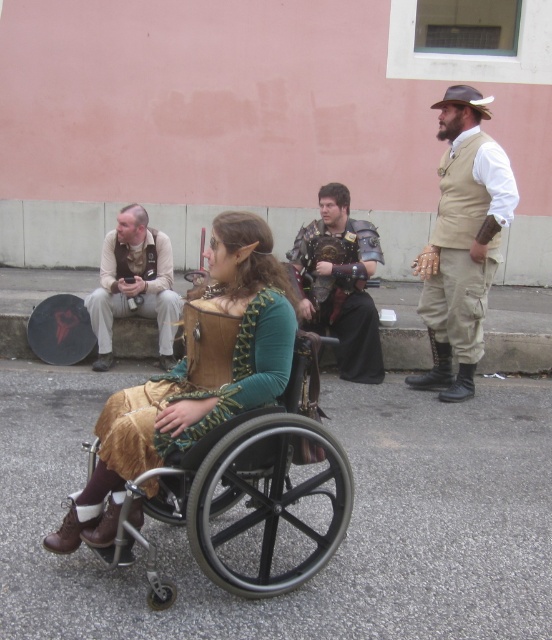
You are standing in front of the scene and want to reach the tan leather vest at upper right. Considering the distance, can you grab it without moving closer?

The tan leather vest at upper right is 4.79 meters from the viewer, so you cannot grab it without moving closer.

You are a costume designer analyzing the image. The tan leather vest at upper right is part of the costume of the seated woman in the wheelchair. Based on its position, can you determine if the vest is positioned to the left or right of her torso?

The tan leather vest at upper right is located at point [463,241], which places it on the right side of her torso.

You are a costume designer observing the scene. You need to ensure the black rubber wheelchair at center and the leather vest at center are both visible in a promotional photo. Which object should be placed closer to the camera to ensure both are fully visible?

The black rubber wheelchair at center is not as tall as the leather vest at center, so to ensure both are fully visible in the photo, the black rubber wheelchair at center should be placed closer to the camera.